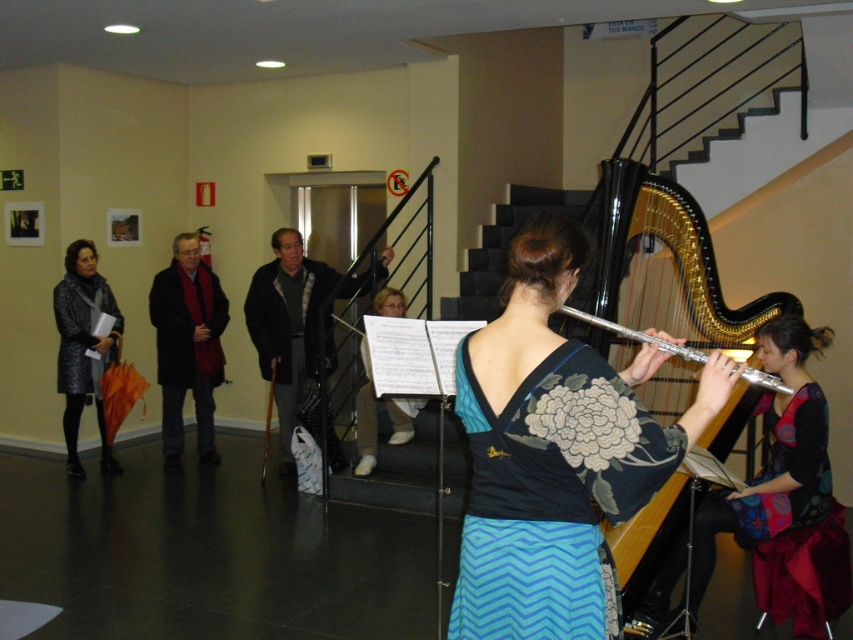
Question: Does dark gray jacket at center have a greater width compared to sparkly black coat at left?

Choices:
 (A) no
 (B) yes

Answer: (B)

Question: Is blue zigzag fabric dress at center smaller than black glossy harp at upper right?

Choices:
 (A) no
 (B) yes

Answer: (B)

Question: Based on their relative distances, which object is farther from the silver metallic flute at center?

Choices:
 (A) multicolored fabric dress at right
 (B) velvet purple dress at lower right
 (C) sparkly black coat at left
 (D) dark gray jacket at center

Answer: (C)

Question: Which point is farther to the camera?

Choices:
 (A) (271, 408)
 (B) (672, 480)
 (C) (386, 273)

Answer: (A)

Question: Which of the following is the farthest from the observer?

Choices:
 (A) velvet purple dress at lower right
 (B) dark gray jacket at center
 (C) multicolored fabric dress at right
 (D) blue zigzag fabric dress at center

Answer: (B)

Question: Can you confirm if multicolored fabric dress at right is positioned to the left of wooden flute at center?

Choices:
 (A) yes
 (B) no

Answer: (B)